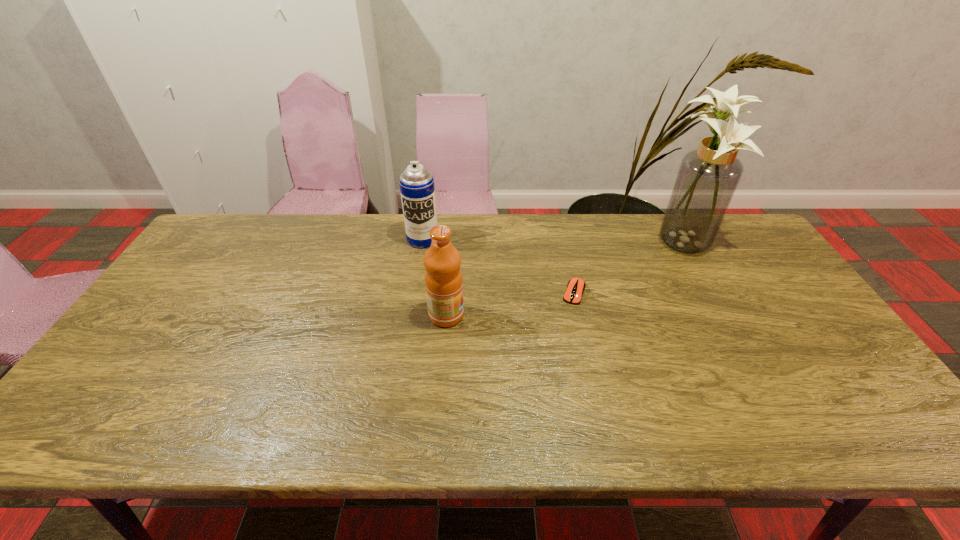
Where is `flower arrangement at the far edge`? The image size is (960, 540). flower arrangement at the far edge is located at coordinates (707, 179).

I want to click on aerosol can that is at the far edge, so click(417, 189).

Find the location of a particular element. The image size is (960, 540). object located in the right edge section of the desktop is located at coordinates (707, 179).

Find the location of a particular element. This screenshot has width=960, height=540. object that is at the far right corner is located at coordinates tap(707, 179).

Where is `vacant area at the far edge of the desktop`? vacant area at the far edge of the desktop is located at coordinates (536, 247).

Image resolution: width=960 pixels, height=540 pixels. In order to click on vacant space at the near edge of the desktop in this screenshot , I will do `click(729, 408)`.

This screenshot has width=960, height=540. Find the location of `free space at the left edge of the desktop`. free space at the left edge of the desktop is located at coordinates (180, 354).

At what (x,y) coordinates should I click in order to perform the action: click on vacant area at the right edge. Please return your answer as a coordinate pair (x, y). Looking at the image, I should click on (793, 316).

Where is `free space at the far left corner of the desktop`? The image size is (960, 540). free space at the far left corner of the desktop is located at coordinates (220, 252).

Locate an element on the screen. vacant point at the near left corner is located at coordinates (128, 431).